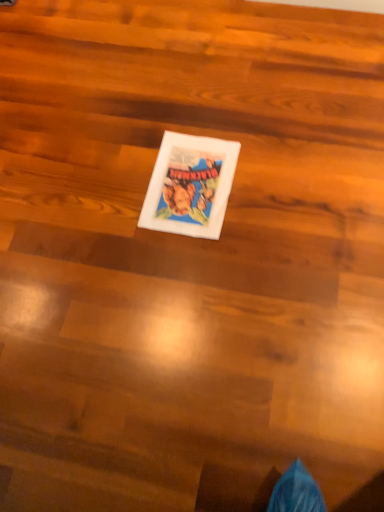
This screenshot has width=384, height=512. Identify the location of vacant space underneath white matte comic book at center (from a real-world perspective). (188, 185).